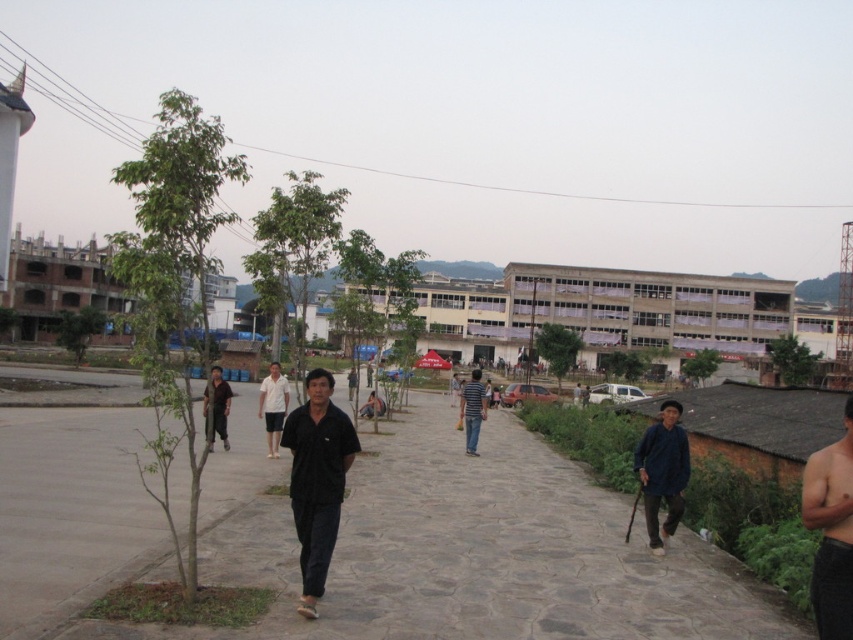
Question: Which point is closer to the camera?

Choices:
 (A) [x=206, y=545]
 (B) [x=479, y=397]
 (C) [x=659, y=472]

Answer: (A)

Question: Among these objects, which one is farthest from the camera?

Choices:
 (A) dark blue fabric at lower right
 (B) striped fabric shirt at center
 (C) white matte shirt at center
 (D) shiny skin torso at right

Answer: (B)

Question: Is shiny skin torso at right behind striped fabric shirt at center?

Choices:
 (A) no
 (B) yes

Answer: (A)

Question: Which point is closer to the camera taking this photo?

Choices:
 (A) 670,448
 (B) 428,625
 (C) 836,634
 (D) 471,420

Answer: (C)

Question: Does black matte shirt at center lie behind dark blue fabric at lower right?

Choices:
 (A) yes
 (B) no

Answer: (B)

Question: Observing the image, what is the correct spatial positioning of shiny skin torso at right in reference to striped fabric shirt at center?

Choices:
 (A) right
 (B) left

Answer: (A)